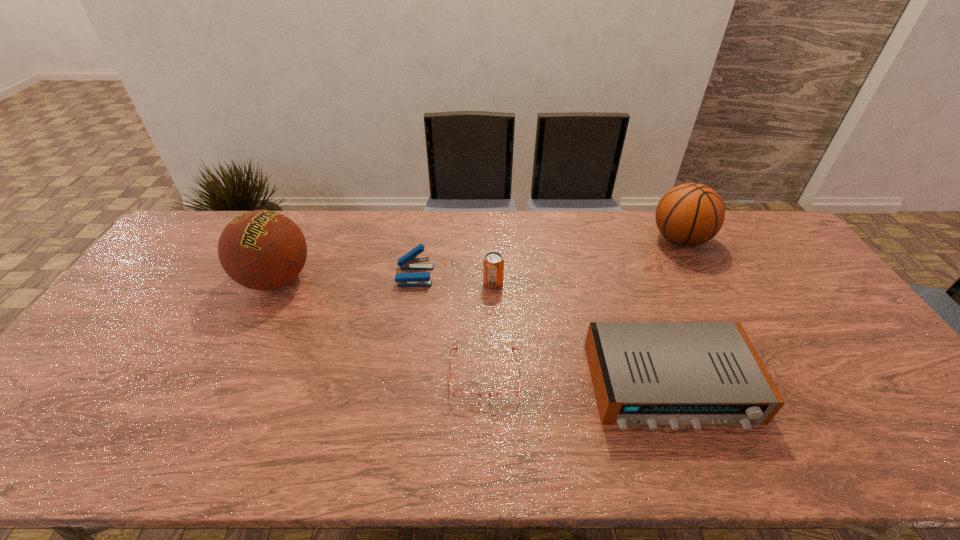
The height and width of the screenshot is (540, 960). In order to click on the left basketball in this screenshot , I will do `click(262, 250)`.

Find the location of a particular element. The image size is (960, 540). the right basketball is located at coordinates (690, 214).

Where is `the shorter basketball`? The height and width of the screenshot is (540, 960). the shorter basketball is located at coordinates coord(690,214).

The image size is (960, 540). I want to click on soda can, so click(x=493, y=264).

I want to click on radio receiver, so point(644,373).

Where is `stapler`? The width and height of the screenshot is (960, 540). stapler is located at coordinates (409, 261).

Where is `spectacles`? spectacles is located at coordinates (467, 396).

Find the location of `vacant area located on the back of the left basketball`. vacant area located on the back of the left basketball is located at coordinates (306, 220).

Find the location of a particular element. This screenshot has height=540, width=960. blank area located 0.170m on the right of the fifth shortest object is located at coordinates (759, 239).

The height and width of the screenshot is (540, 960). Identify the location of free space located 0.070m on the front of the soda can. [494, 307].